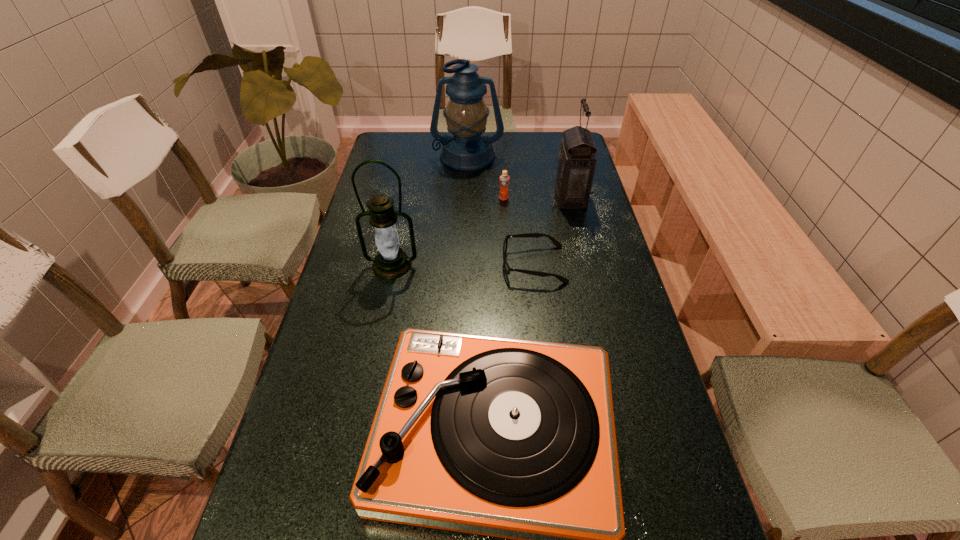
Locate an element on the screen. The width and height of the screenshot is (960, 540). the second closest object to the record player is located at coordinates (391, 262).

Choose which lantern is the second nearest neighbor to the shortest object. Please provide its 2D coordinates. Your answer should be formatted as a tuple, i.e. [(x, y)], where the tuple contains the x and y coordinates of a point satisfying the conditions above.

[(391, 262)]

Choose which lantern is the second nearest neighbor to the nearest lantern. Please provide its 2D coordinates. Your answer should be formatted as a tuple, i.e. [(x, y)], where the tuple contains the x and y coordinates of a point satisfying the conditions above.

[(576, 162)]

This screenshot has height=540, width=960. In order to click on vacant space that satisfies the following two spatial constraints: 1. on the front-facing side of the second farthest lantern; 2. on the side where the nearest lantern emits light in this screenshot , I will do `click(588, 265)`.

Identify the location of free region that satisfies the following two spatial constraints: 1. on the face of the second shortest object; 2. on the right side of the farthest object. (466, 198).

Identify the location of free spot that satisfies the following two spatial constraints: 1. on the face of the farthest lantern; 2. on the left side of the second shortest object. This screenshot has height=540, width=960. (466, 198).